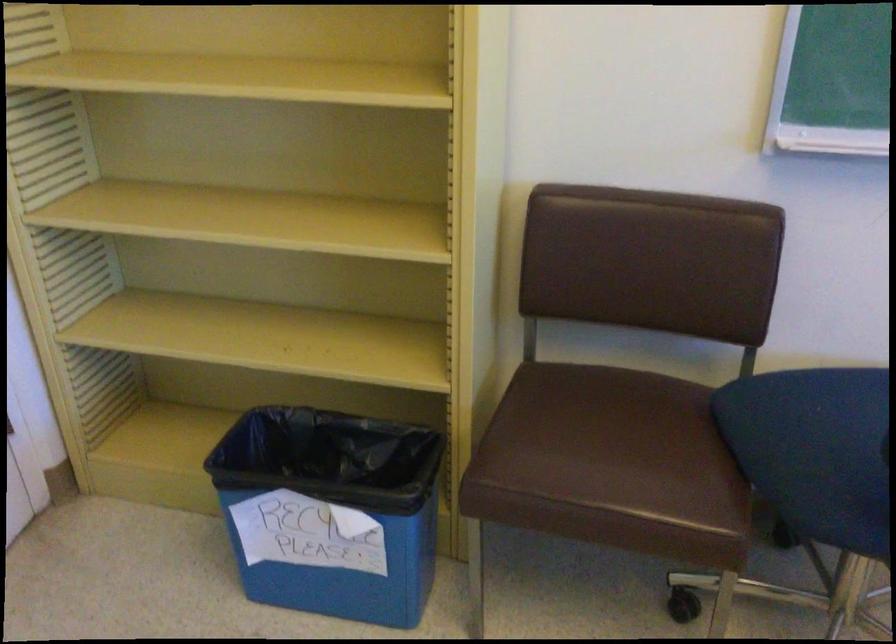
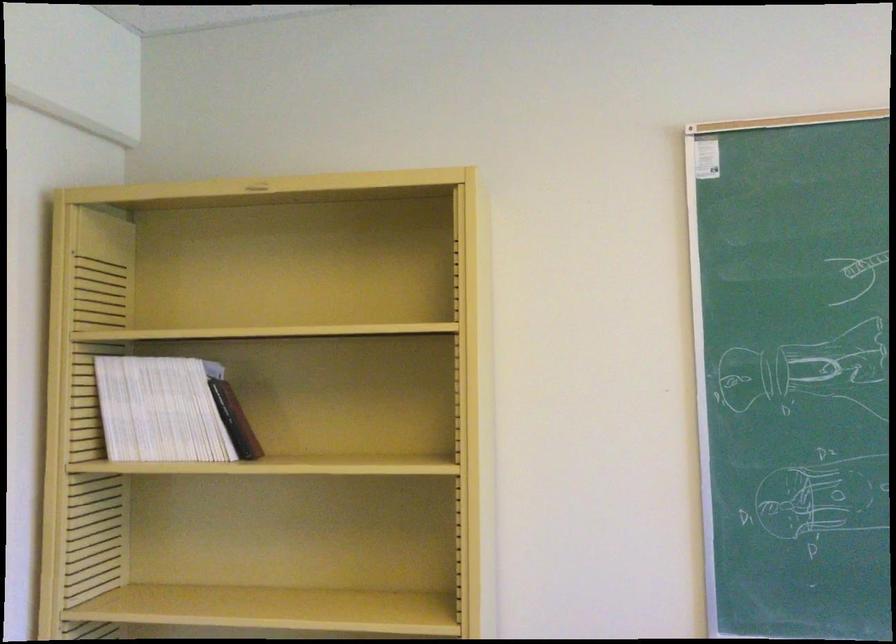
Question: The images are taken continuously from a first-person perspective. In which direction is your viewpoint rotating?

Choices:
 (A) Left
 (B) Right
 (C) Up
 (D) Down

Answer: (C)